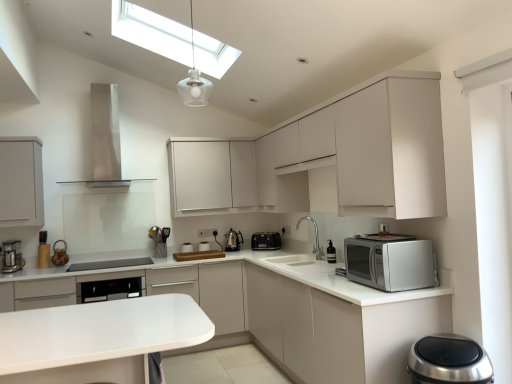
Question: In which direction should I rotate to look at white matte toaster at center, which is the third appliance from left to right?

Choices:
 (A) right
 (B) left

Answer: (B)

Question: Is matte white cabinet at left, arranged as the first cabinetry when viewed from the left, to the left of white glossy countertop at right, the first countertop viewed from the front, from the viewer's perspective?

Choices:
 (A) no
 (B) yes

Answer: (B)

Question: Is white glossy countertop at right, the first countertop viewed from the front, located within matte white cabinet at left, placed as the 4th cabinetry when sorted from right to left?

Choices:
 (A) no
 (B) yes

Answer: (A)

Question: Is matte white cabinet at left, placed as the 4th cabinetry when sorted from right to left, facing towards white glossy countertop at right, the first countertop viewed from the front?

Choices:
 (A) yes
 (B) no

Answer: (B)

Question: Would you consider matte white cabinet at left, placed as the 4th cabinetry when sorted from right to left, to be distant from white glossy countertop at right, the first countertop viewed from the front?

Choices:
 (A) no
 (B) yes

Answer: (B)

Question: From the image's perspective, would you say matte white cabinet at left, arranged as the first cabinetry when viewed from the left, is shown under white glossy countertop at right, arranged as the second countertop when viewed from the back?

Choices:
 (A) no
 (B) yes

Answer: (A)

Question: Is matte white cabinet at left, placed as the 4th cabinetry when sorted from right to left, bigger than white glossy countertop at right, arranged as the second countertop when viewed from the back?

Choices:
 (A) yes
 (B) no

Answer: (B)

Question: From the image's perspective, is white matte cabinet at right, arranged as the 4th cabinetry when viewed from the left, located beneath satin black oven at lower center?

Choices:
 (A) yes
 (B) no

Answer: (A)

Question: Does white matte cabinet at right, positioned as the 1th cabinetry in right-to-left order, have a smaller size compared to satin black oven at lower center?

Choices:
 (A) no
 (B) yes

Answer: (A)

Question: Considering the relative sizes of white matte cabinet at right, positioned as the 1th cabinetry in right-to-left order, and satin black oven at lower center in the image provided, is white matte cabinet at right, positioned as the 1th cabinetry in right-to-left order, shorter than satin black oven at lower center?

Choices:
 (A) yes
 (B) no

Answer: (B)

Question: Is white matte cabinet at right, positioned as the 1th cabinetry in right-to-left order, bigger than satin black oven at lower center?

Choices:
 (A) yes
 (B) no

Answer: (A)

Question: Is white matte cabinet at right, positioned as the 1th cabinetry in right-to-left order, at the left side of satin black oven at lower center?

Choices:
 (A) no
 (B) yes

Answer: (A)

Question: Can you confirm if white matte toaster at center, which is the third appliance from left to right, is taller than white glossy countertop at right, arranged as the second countertop when viewed from the back?

Choices:
 (A) yes
 (B) no

Answer: (B)